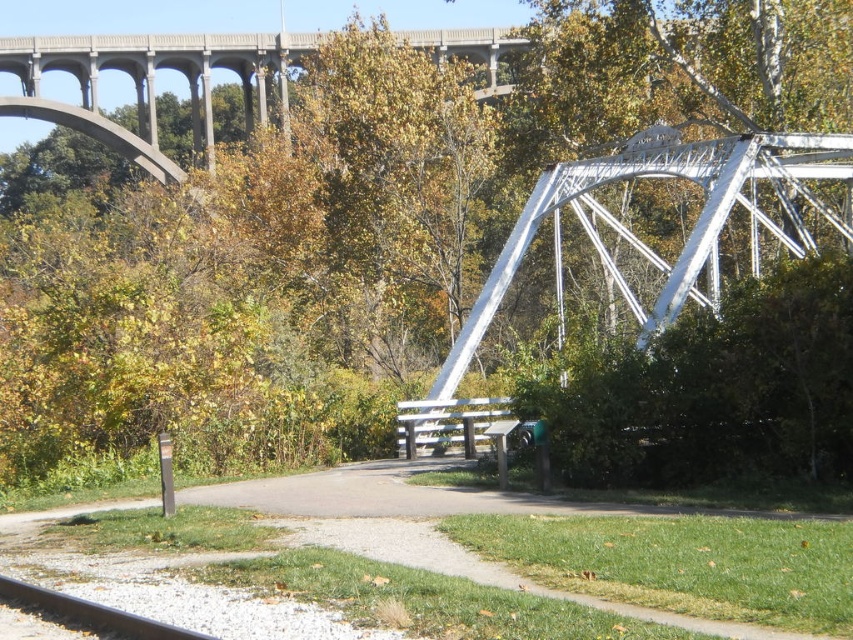
You are a GUI agent. You are given a task and a screenshot of the screen. Output one action in this format:
    pyautogui.click(x=<x>, y=<y>)
    Task: Click on the white metallic bridge at center
    The width and height of the screenshot is (853, 640).
    Given the screenshot: What is the action you would take?
    pyautogui.click(x=642, y=241)

Is point (700, 160) positioned after point (498, 449)?

Yes, point (700, 160) is farther from viewer.

Between white metallic bridge at center and wooden park bench at center, which one appears on the left side from the viewer's perspective?

wooden park bench at center

Is point (792, 170) positioned after point (506, 426)?

Yes, it is.

Find the location of a particular element. The height and width of the screenshot is (640, 853). white metallic bridge at center is located at coordinates tap(642, 241).

Is point (756, 630) closer to camera compared to point (490, 436)?

Yes.

Can you confirm if gravel path at center is positioned to the right of wooden park bench at center?

In fact, gravel path at center is to the left of wooden park bench at center.

This screenshot has height=640, width=853. I want to click on gravel path at center, so click(431, 524).

In order to click on gravel path at center in this screenshot , I will do `click(431, 524)`.